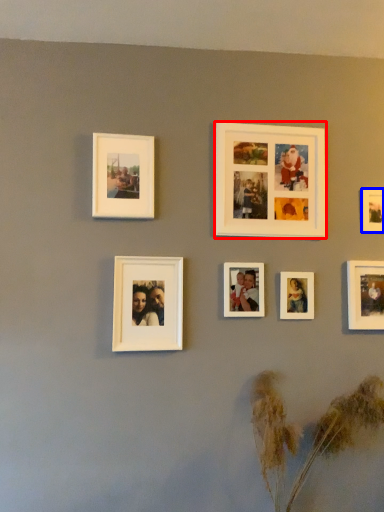
Question: Which object is further to the camera taking this photo, picture frame (highlighted by a red box) or picture frame (highlighted by a blue box)?

Choices:
 (A) picture frame
 (B) picture frame

Answer: (B)